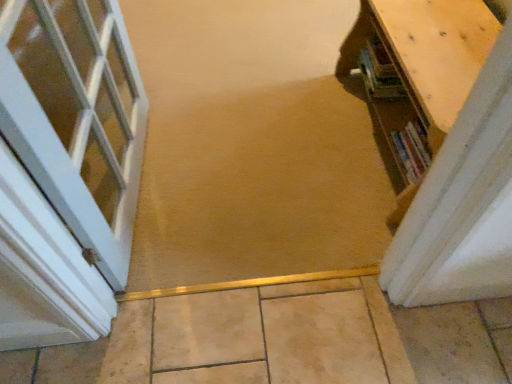
Find the location of a particular element. This screenshot has height=384, width=512. beige tile floor at center is located at coordinates (284, 339).

What do you see at coordinates (284, 339) in the screenshot? The width and height of the screenshot is (512, 384). I see `beige tile floor at center` at bounding box center [284, 339].

The image size is (512, 384). Identify the location of beige tile floor at center. (284, 339).